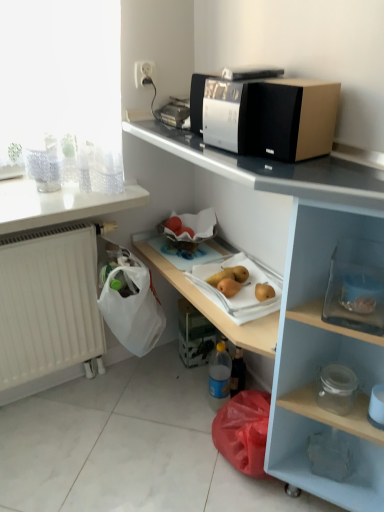
Question: In which direction should I rotate to look at yellow matte pear at lower center, which is counted as the 1th fruit, starting from the left?

Choices:
 (A) left
 (B) right

Answer: (B)

Question: From the image's perspective, is white glossy countertop at upper left, which ranks as the 2th countertop in right-to-left order, under transparent glass container at lower right, which appears as the 1th box when viewed from the right?

Choices:
 (A) no
 (B) yes

Answer: (A)

Question: Does white glossy countertop at upper left, which ranks as the 2th countertop in right-to-left order, come behind transparent glass container at lower right, arranged as the second box when viewed from the left?

Choices:
 (A) no
 (B) yes

Answer: (B)

Question: Is white glossy countertop at upper left, which appears as the 1th countertop when viewed from the left, directly adjacent to transparent glass container at lower right, which appears as the 1th box when viewed from the right?

Choices:
 (A) yes
 (B) no

Answer: (B)

Question: From the image's perspective, is white glossy countertop at upper left, which ranks as the 2th countertop in right-to-left order, on transparent glass container at lower right, arranged as the second box when viewed from the left?

Choices:
 (A) yes
 (B) no

Answer: (A)

Question: Does white glossy countertop at upper left, which appears as the 1th countertop when viewed from the left, have a lesser height compared to transparent glass container at lower right, the 1th box from the front?

Choices:
 (A) no
 (B) yes

Answer: (B)

Question: Does white glossy countertop at upper left, which ranks as the 2th countertop in right-to-left order, appear on the left side of transparent glass container at lower right, which appears as the 1th box when viewed from the right?

Choices:
 (A) yes
 (B) no

Answer: (A)

Question: Can we say silver metallic microwave at upper center lies outside white plastic socket at upper center?

Choices:
 (A) no
 (B) yes

Answer: (B)

Question: Is the depth of silver metallic microwave at upper center greater than that of white plastic socket at upper center?

Choices:
 (A) yes
 (B) no

Answer: (B)

Question: Is silver metallic microwave at upper center aimed at white plastic socket at upper center?

Choices:
 (A) no
 (B) yes

Answer: (A)

Question: Considering the relative sizes of silver metallic microwave at upper center and white plastic socket at upper center in the image provided, is silver metallic microwave at upper center thinner than white plastic socket at upper center?

Choices:
 (A) no
 (B) yes

Answer: (A)

Question: Can you confirm if silver metallic microwave at upper center is smaller than white plastic socket at upper center?

Choices:
 (A) no
 (B) yes

Answer: (A)

Question: From a real-world perspective, is silver metallic microwave at upper center positioned over white plastic socket at upper center based on gravity?

Choices:
 (A) no
 (B) yes

Answer: (A)

Question: Is white plastic socket at upper center aimed at transparent glass jar at lower right, the first appliance viewed from the right?

Choices:
 (A) no
 (B) yes

Answer: (A)